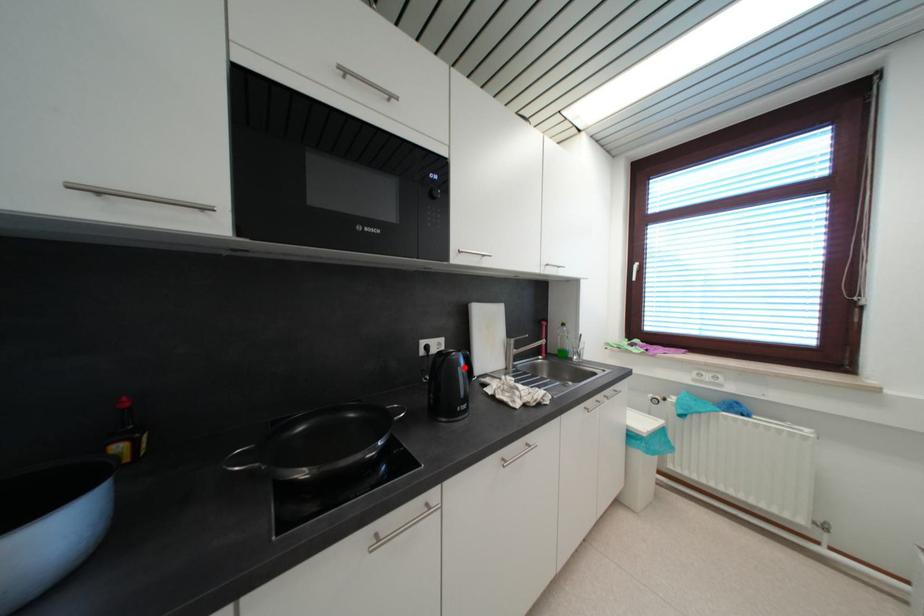
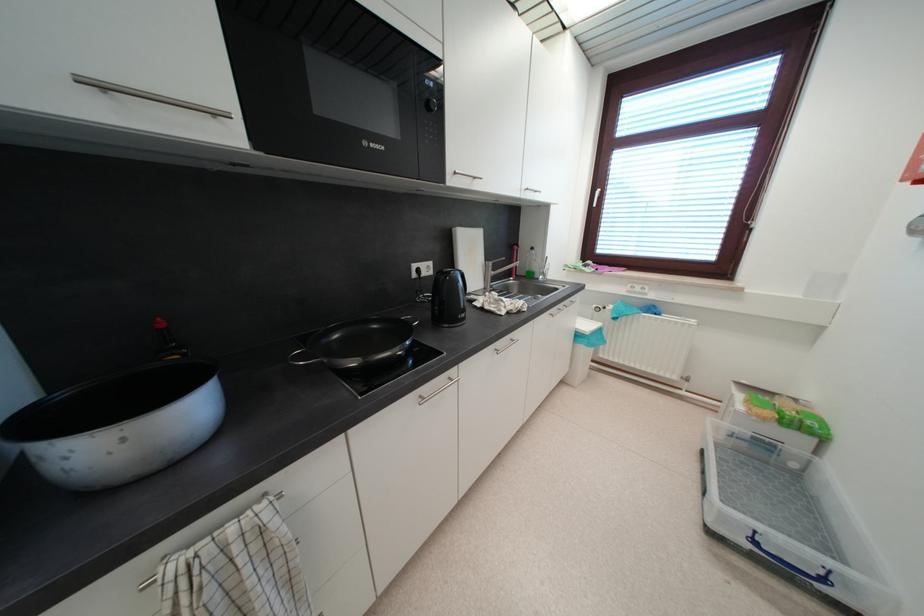
Question: I am providing you with two images of the same scene from different viewpoints. A red point is marked on the first image. Can you still see the location of the red point in image 2?

Choices:
 (A) Yes
 (B) No

Answer: (A)